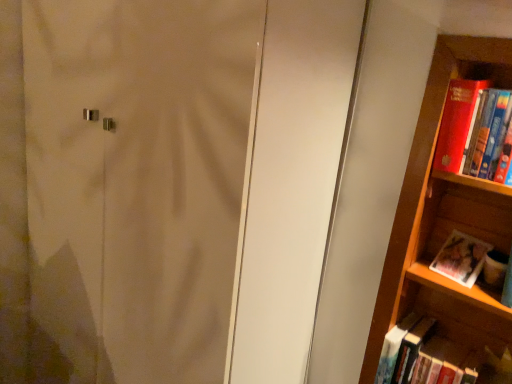
Question: Considering the relative sizes of matte white screen door at center and red matte book at right, which is the 1th book from top to bottom, in the image provided, is matte white screen door at center taller than red matte book at right, which is the 1th book from top to bottom,?

Choices:
 (A) no
 (B) yes

Answer: (B)

Question: Is matte white screen door at center looking in the opposite direction of red matte book at right, which is the 1th book from top to bottom?

Choices:
 (A) yes
 (B) no

Answer: (B)

Question: From a real-world perspective, is matte white screen door at center located beneath red matte book at right, which is the 1th book from top to bottom?

Choices:
 (A) no
 (B) yes

Answer: (B)

Question: Are matte white screen door at center and red matte book at right, which is counted as the 3th book, starting from the bottom, beside each other?

Choices:
 (A) no
 (B) yes

Answer: (A)

Question: Does matte white screen door at center have a greater width compared to red matte book at right, which is counted as the 3th book, starting from the bottom?

Choices:
 (A) yes
 (B) no

Answer: (A)

Question: Is the depth of matte white screen door at center greater than that of red matte book at right, which is the 1th book from top to bottom?

Choices:
 (A) yes
 (B) no

Answer: (B)

Question: Considering the relative sizes of matte paper photo album at right, which ranks as the 2th book in bottom-to-top order, and hardcover book at lower right, positioned as the third book in top-to-bottom order, in the image provided, is matte paper photo album at right, which ranks as the 2th book in bottom-to-top order, wider than hardcover book at lower right, positioned as the third book in top-to-bottom order,?

Choices:
 (A) no
 (B) yes

Answer: (A)

Question: From the image's perspective, is matte paper photo album at right, which ranks as the 2th book in bottom-to-top order, beneath hardcover book at lower right, positioned as the first book in bottom-to-top order?

Choices:
 (A) no
 (B) yes

Answer: (A)

Question: Can you confirm if matte paper photo album at right, which ranks as the second book in top-to-bottom order, is smaller than hardcover book at lower right, positioned as the third book in top-to-bottom order?

Choices:
 (A) yes
 (B) no

Answer: (A)

Question: From the image's perspective, is matte paper photo album at right, which ranks as the second book in top-to-bottom order, over hardcover book at lower right, positioned as the third book in top-to-bottom order?

Choices:
 (A) no
 (B) yes

Answer: (B)

Question: Is matte paper photo album at right, which ranks as the second book in top-to-bottom order, facing towards hardcover book at lower right, positioned as the third book in top-to-bottom order?

Choices:
 (A) yes
 (B) no

Answer: (B)

Question: Is matte paper photo album at right, which ranks as the 2th book in bottom-to-top order, not inside hardcover book at lower right, positioned as the third book in top-to-bottom order?

Choices:
 (A) no
 (B) yes

Answer: (B)

Question: Is matte white screen door at center outside of hardcover book at lower right, positioned as the first book in bottom-to-top order?

Choices:
 (A) yes
 (B) no

Answer: (A)